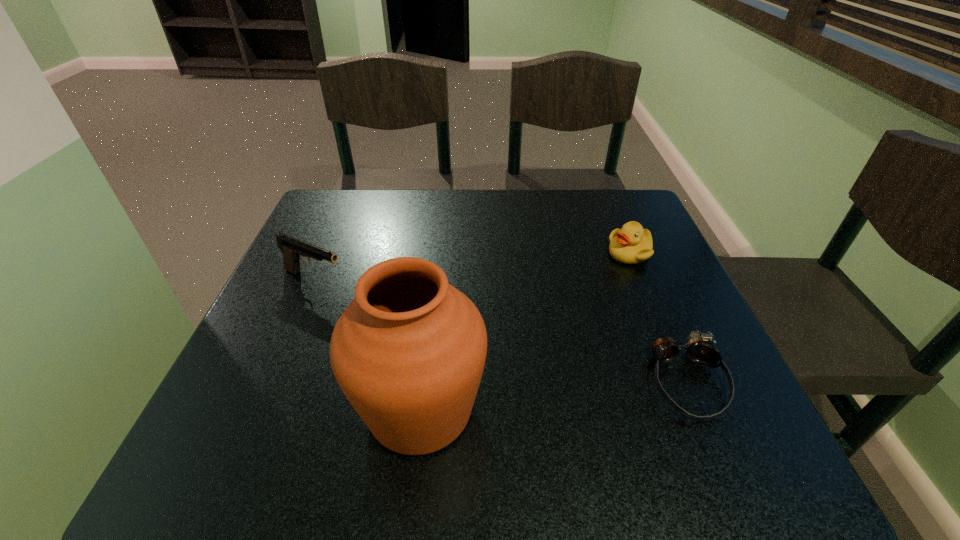
Where is `vacant space on the desktop that is between the tallest object and the shortest object and is positioned on the front-facing side of the second shortest object`? vacant space on the desktop that is between the tallest object and the shortest object and is positioned on the front-facing side of the second shortest object is located at coordinates (533, 398).

Where is `vacant spot on the desktop that is between the tallest object and the goggles and is positioned at the muzzle of the second tallest object`? vacant spot on the desktop that is between the tallest object and the goggles and is positioned at the muzzle of the second tallest object is located at coordinates (588, 393).